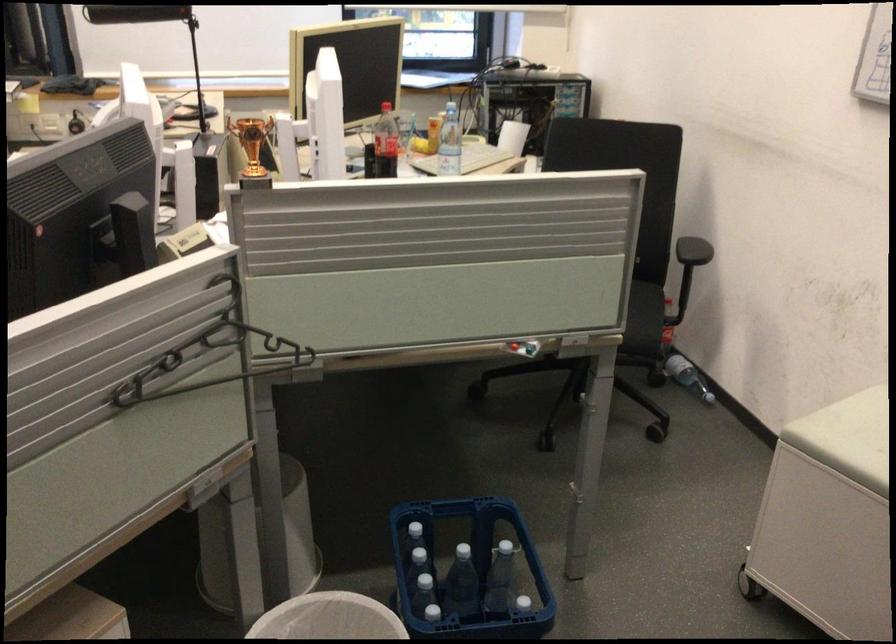
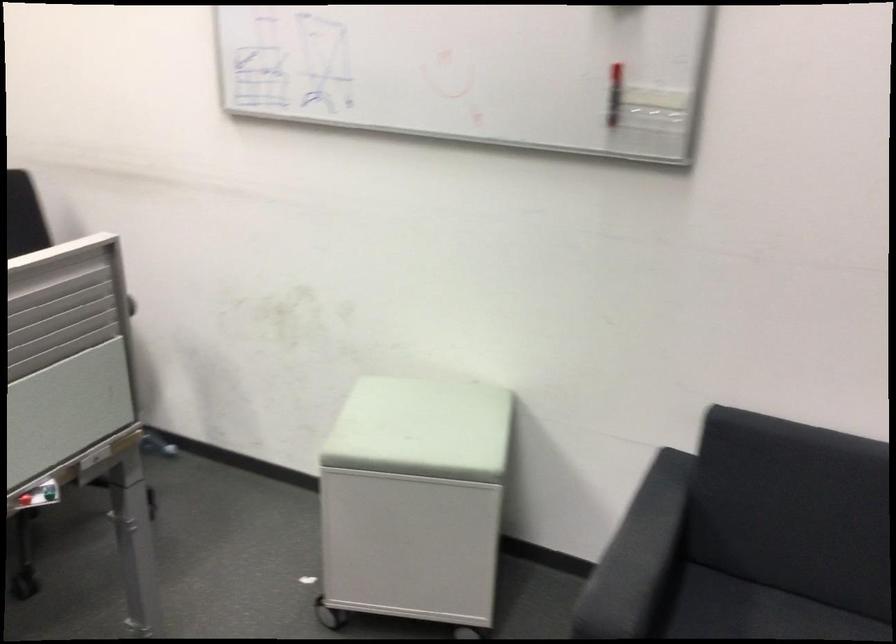
Question: Based on the continuous images, in which direction is the camera rotating? Reply with the corresponding letter.

Choices:
 (A) Left
 (B) Right
 (C) Up
 (D) Down

Answer: (B)